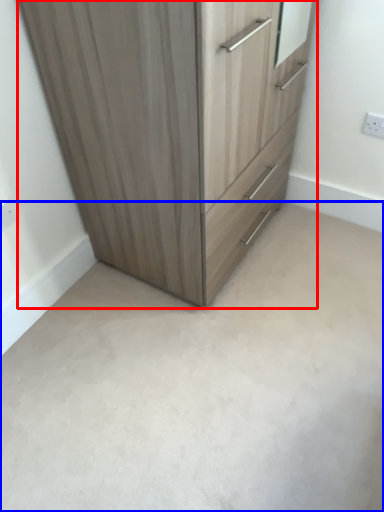
Question: Among these objects, which one is nearest to the camera, chest of drawers (highlighted by a red box) or concrete (highlighted by a blue box)?

Choices:
 (A) chest of drawers
 (B) concrete

Answer: (A)